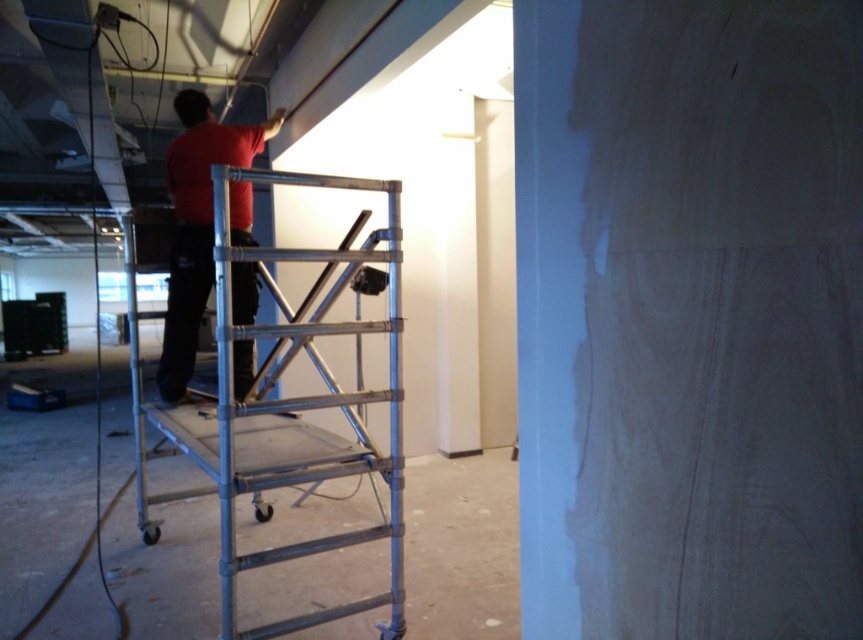
You are standing in the construction area and need to determine which of the two points, point (197, 429) or point (236, 192), is nearer to you. Can you identify the closer one based on their positions?

Point (197, 429) is closer to the viewer than point (236, 192), so it is the nearer one.

You are a safety inspector checking the workspace. You notice the silver metallic scaffolding at center and the red matte shirt at upper center. Based on their sizes, which object would you say is more likely to block the emergency exit located to the right of the scaffolding?

The silver metallic scaffolding at center is wider than the red matte shirt at upper center, so it is more likely to block the emergency exit located to the right of the scaffolding.

You are a safety inspector in the room and need to ensure the red matte shirt at upper center and the silver metallic scaffolding at center are positioned safely. Based on their positions, which object is closer to the left wall?

The red matte shirt at upper center is closer to the left wall because the silver metallic scaffolding at center is positioned to its right, meaning the shirt is nearer to the left side of the room.